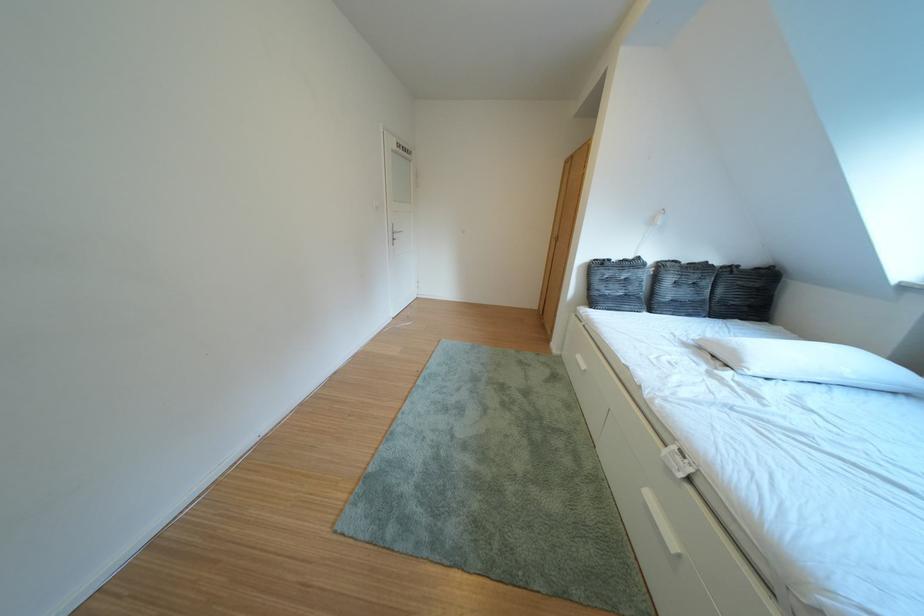
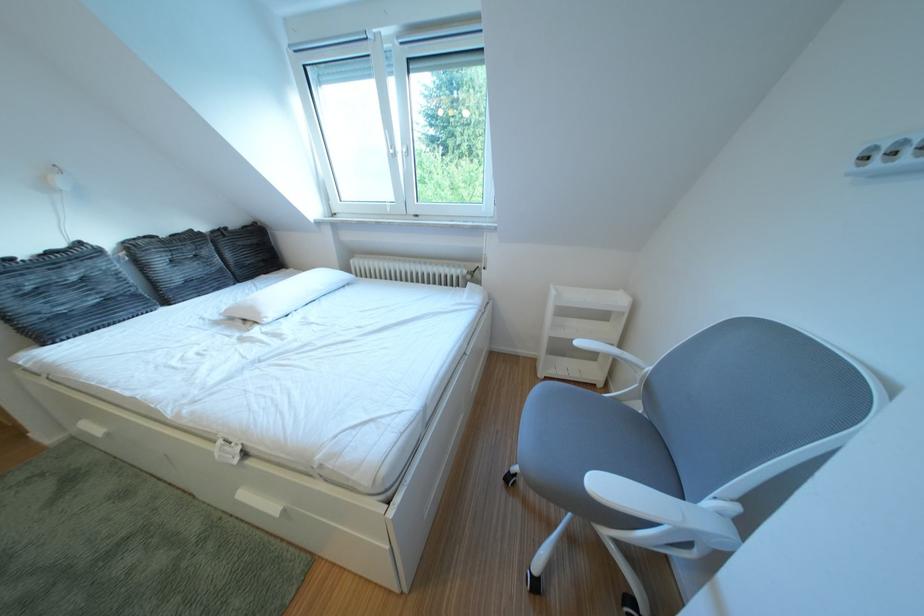
Locate, in the second image, the point that corresponds to point (763, 267) in the first image.

(247, 228)